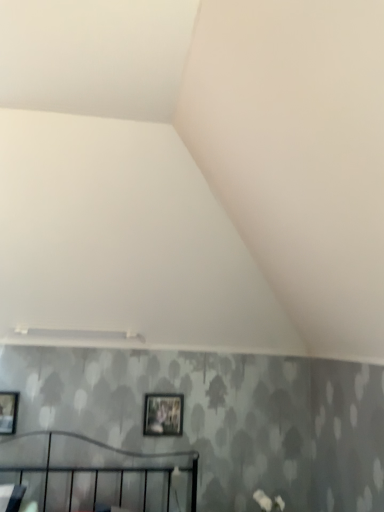
Question: Should I look upward or downward to see matte black picture frame at center, positioned as the 2th picture frame in front-to-back order?

Choices:
 (A) down
 (B) up

Answer: (A)

Question: Is matte black picture frame at left, marked as the first picture frame in a left-to-right arrangement, at the left side of white matte flower at lower right?

Choices:
 (A) no
 (B) yes

Answer: (B)

Question: Is white matte flower at lower right completely or partially inside matte black picture frame at left, the 2th picture frame viewed from the right?

Choices:
 (A) yes
 (B) no

Answer: (B)

Question: From the image's perspective, would you say matte black picture frame at left, marked as the first picture frame in a left-to-right arrangement, is shown under white matte flower at lower right?

Choices:
 (A) yes
 (B) no

Answer: (B)

Question: Is matte black picture frame at left, the 2th picture frame viewed from the right, located outside white matte flower at lower right?

Choices:
 (A) yes
 (B) no

Answer: (A)

Question: Can you see matte black picture frame at left, marked as the first picture frame in a left-to-right arrangement, touching white matte flower at lower right?

Choices:
 (A) no
 (B) yes

Answer: (A)

Question: From a real-world perspective, is matte black picture frame at left, the 1th picture frame viewed from the front, over white matte flower at lower right?

Choices:
 (A) no
 (B) yes

Answer: (B)

Question: Is white matte flower at lower right facing away from matte black picture frame at left, the 1th picture frame viewed from the front?

Choices:
 (A) yes
 (B) no

Answer: (B)

Question: Can you confirm if white matte flower at lower right is bigger than matte black picture frame at left, the 1th picture frame viewed from the front?

Choices:
 (A) yes
 (B) no

Answer: (A)

Question: Considering the relative positions of white matte flower at lower right and matte black picture frame at left, marked as the first picture frame in a left-to-right arrangement, in the image provided, is white matte flower at lower right to the right of matte black picture frame at left, marked as the first picture frame in a left-to-right arrangement, from the viewer's perspective?

Choices:
 (A) no
 (B) yes

Answer: (B)

Question: From the image's perspective, is white matte flower at lower right on matte black picture frame at left, the 2th picture frame viewed from the right?

Choices:
 (A) no
 (B) yes

Answer: (A)

Question: Are white matte flower at lower right and matte black picture frame at left, the 2th picture frame viewed from the right, beside each other?

Choices:
 (A) yes
 (B) no

Answer: (B)

Question: Is white matte flower at lower right behind matte black picture frame at left, the 1th picture frame viewed from the front?

Choices:
 (A) yes
 (B) no

Answer: (B)

Question: Is matte black picture frame at left, the 1th picture frame viewed from the front, located outside matte black picture frame at center, which is the second picture frame in left-to-right order?

Choices:
 (A) yes
 (B) no

Answer: (A)